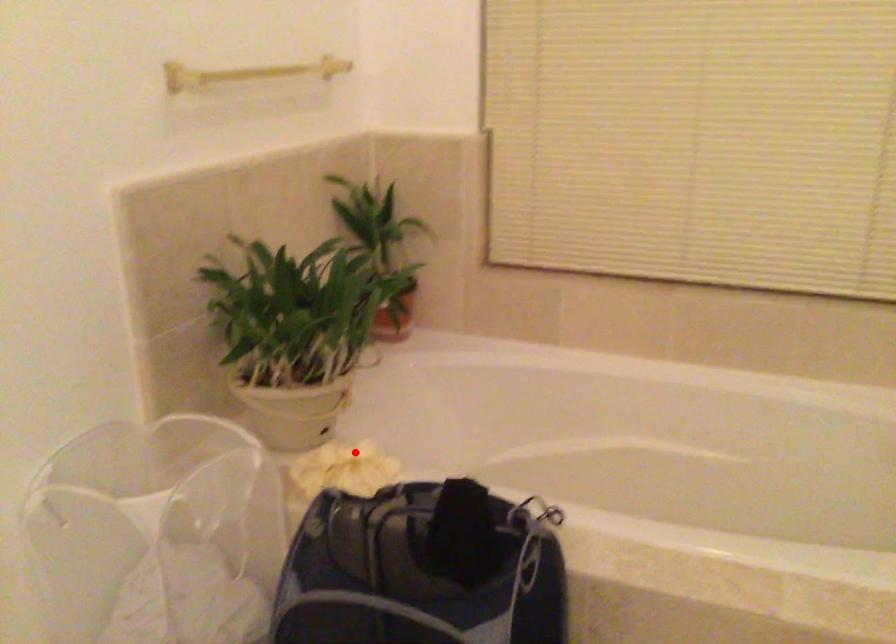
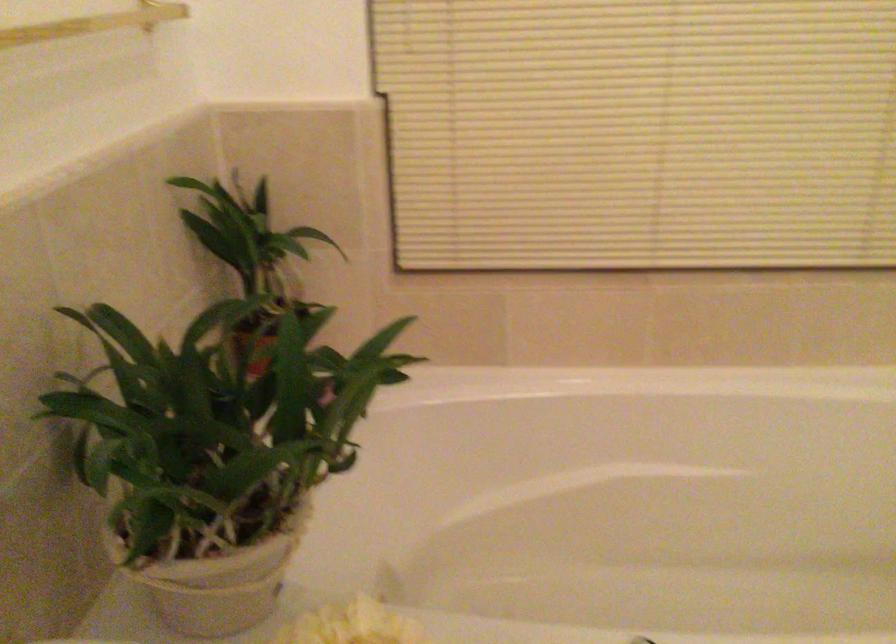
Find the pixel in the second image that matches the highlighted location in the first image.

(351, 625)